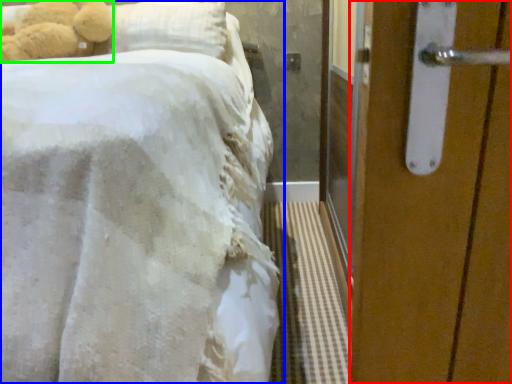
Question: Based on their relative distances, which object is nearer to door (highlighted by a red box)? Choose from bed (highlighted by a blue box) and teddy bear (highlighted by a green box).

Choices:
 (A) bed
 (B) teddy bear

Answer: (A)